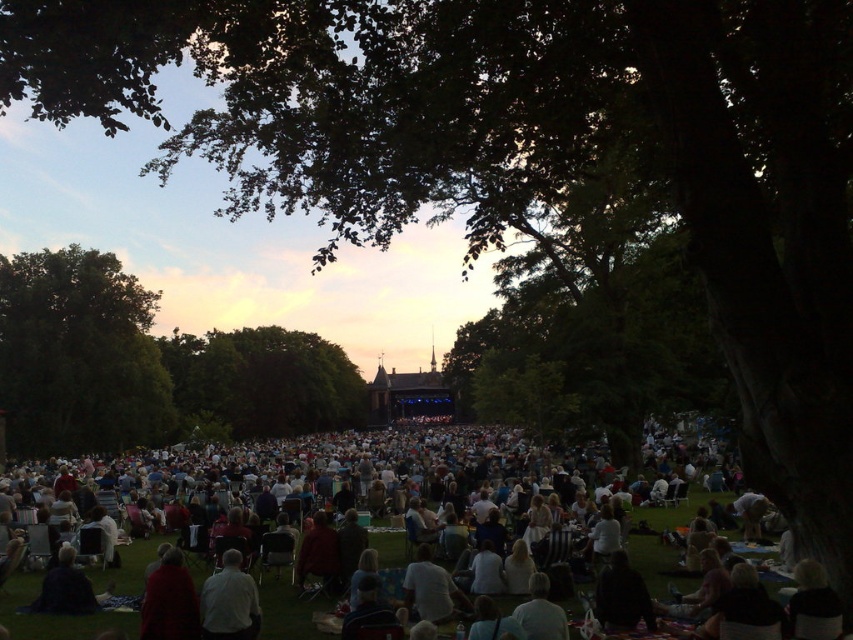
Is light beige fabric blanket at center behind green leafy tree at left?

That is False.

Is point (126, 602) behind point (54, 372)?

No, it is not.

Which is behind, point (654, 636) or point (28, 312)?

The point (28, 312) is behind.

At what (x,y) coordinates should I click in order to perform the action: click on light beige fabric blanket at center. Please return your answer as a coordinate pair (x, y). Image resolution: width=853 pixels, height=640 pixels. Looking at the image, I should click on (322, 460).

Is light beige fabric blanket at center to the right of green leafy tree at center from the viewer's perspective?

Indeed, light beige fabric blanket at center is positioned on the right side of green leafy tree at center.

Does light beige fabric blanket at center have a lesser width compared to green leafy tree at center?

In fact, light beige fabric blanket at center might be wider than green leafy tree at center.

Where is `light beige fabric blanket at center`? This screenshot has height=640, width=853. light beige fabric blanket at center is located at coordinates [322, 460].

Can you confirm if green leafy tree at left is shorter than white fabric shirt at lower center?

Incorrect, green leafy tree at left's height does not fall short of white fabric shirt at lower center's.

This screenshot has width=853, height=640. Describe the element at coordinates (78, 355) in the screenshot. I see `green leafy tree at left` at that location.

The image size is (853, 640). I want to click on green leafy tree at left, so click(x=78, y=355).